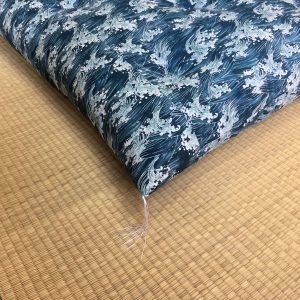
You are a GUI agent. You are given a task and a screenshot of the screen. Output one action in this format:
    pyautogui.click(x=<x>, y=<y>)
    Task: Click on the bottom left corner of pillow
    
    Given the screenshot: What is the action you would take?
    pyautogui.click(x=146, y=190)